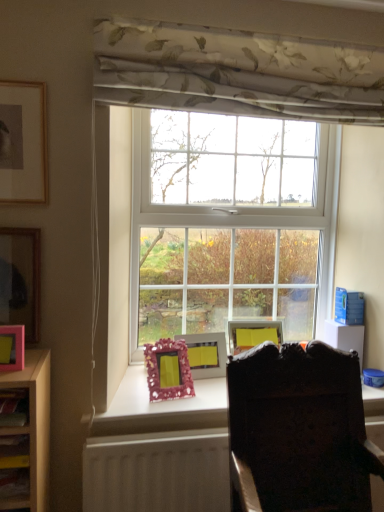
Question: Can you confirm if dark wood chair at center is shorter than matte gold picture frame at upper left, the fourth picture frame viewed from the right?

Choices:
 (A) no
 (B) yes

Answer: (A)

Question: Is the depth of dark wood chair at center less than that of matte gold picture frame at upper left, the 2th picture frame in the front-to-back sequence?

Choices:
 (A) no
 (B) yes

Answer: (B)

Question: Is dark wood chair at center oriented towards matte gold picture frame at upper left, the 1th picture frame viewed from the top?

Choices:
 (A) no
 (B) yes

Answer: (A)

Question: Is matte gold picture frame at upper left, the 5th picture frame from the bottom, inside dark wood chair at center?

Choices:
 (A) yes
 (B) no

Answer: (B)

Question: Considering the relative sizes of dark wood chair at center and matte gold picture frame at upper left, arranged as the fourth picture frame when viewed from the back, in the image provided, is dark wood chair at center thinner than matte gold picture frame at upper left, arranged as the fourth picture frame when viewed from the back,?

Choices:
 (A) no
 (B) yes

Answer: (A)

Question: From the image's perspective, is dark wood chair at center under matte gold picture frame at upper left, acting as the 2th picture frame starting from the left?

Choices:
 (A) no
 (B) yes

Answer: (B)

Question: Considering the relative sizes of matte pink picture frame at center, placed as the 5th picture frame when sorted from left to right, and dark wood chair at center in the image provided, is matte pink picture frame at center, placed as the 5th picture frame when sorted from left to right, thinner than dark wood chair at center?

Choices:
 (A) no
 (B) yes

Answer: (B)

Question: Does matte pink picture frame at center, which is counted as the 4th picture frame, starting from the top, appear on the right side of dark wood chair at center?

Choices:
 (A) no
 (B) yes

Answer: (A)

Question: Is matte pink picture frame at center, the first picture frame in the back-to-front sequence, positioned in front of dark wood chair at center?

Choices:
 (A) no
 (B) yes

Answer: (A)

Question: Would you consider matte pink picture frame at center, placed as the 5th picture frame when sorted from left to right, to be distant from dark wood chair at center?

Choices:
 (A) no
 (B) yes

Answer: (A)

Question: Is matte pink picture frame at center, the first picture frame in the back-to-front sequence, turned away from dark wood chair at center?

Choices:
 (A) yes
 (B) no

Answer: (B)

Question: Is matte pink picture frame at center, which is counted as the 4th picture frame, starting from the top, bigger than dark wood chair at center?

Choices:
 (A) yes
 (B) no

Answer: (B)

Question: Is pink matte picture frame at left, the second picture frame from the top, oriented away from pink glittery picture frame at center, the second picture frame from the right?

Choices:
 (A) yes
 (B) no

Answer: (B)